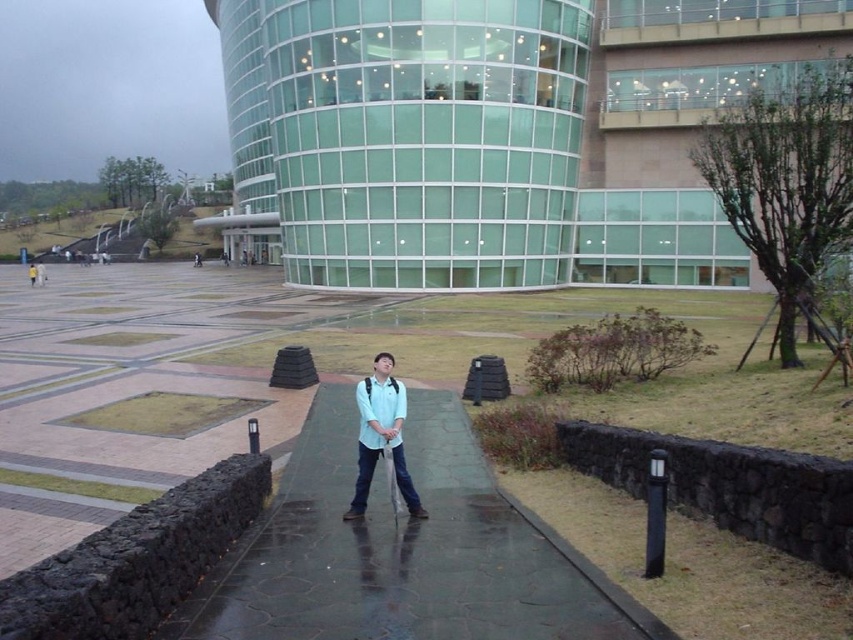
Is point (412, 580) more distant than point (370, 417)?

No.

Does point (343, 605) come closer to viewer compared to point (374, 396)?

Yes, it is in front of point (374, 396).

Is point (248, 538) closer to viewer compared to point (357, 477)?

That is True.

You are a GUI agent. You are given a task and a screenshot of the screen. Output one action in this format:
    pyautogui.click(x=<x>, y=<y>)
    Task: Click on the smooth concrete path at center
    This screenshot has height=640, width=853.
    Given the screenshot: What is the action you would take?
    pyautogui.click(x=403, y=552)